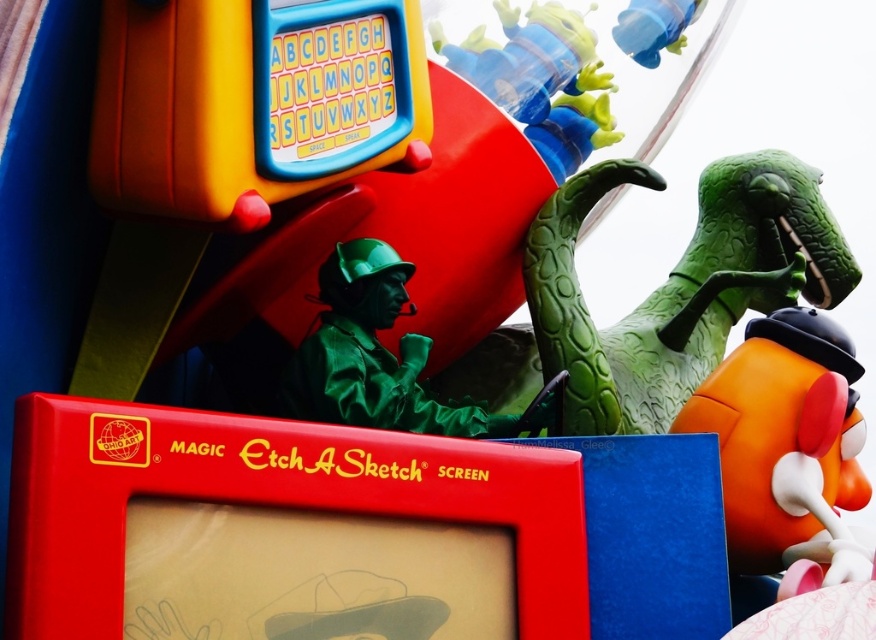
You are a child playing with the orange matte mr potato head at right and the green matte figure at center. You want to give the mr potato head to the figure. Which direction should you move the mr potato head to reach the figure?

The green matte figure at center is behind the orange matte mr potato head at right, so you should move the orange matte mr potato head at right backward to reach the green matte figure at center.

You are a child looking at the image and want to know which object is taller between the translucent blue figure at upper center and the blue rubber duck at upper center. Can you tell me?

The translucent blue figure at upper center is taller than the blue rubber duck at upper center according to the description.

You are a child who wants to place both the orange matte mr potato head at right and the green matte figure at center on a shelf that can only hold items up to the height of the taller object. Which object determines the maximum height limit for the shelf?

The orange matte mr potato head at right is taller than the green matte figure at center, so the maximum height limit for the shelf must be at least the height of the orange matte mr potato head at right to accommodate both items.